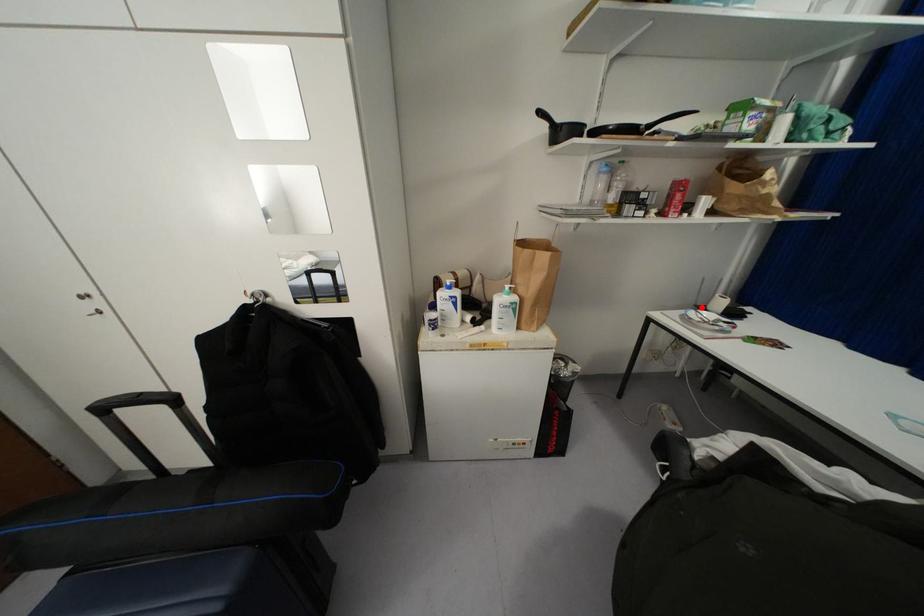
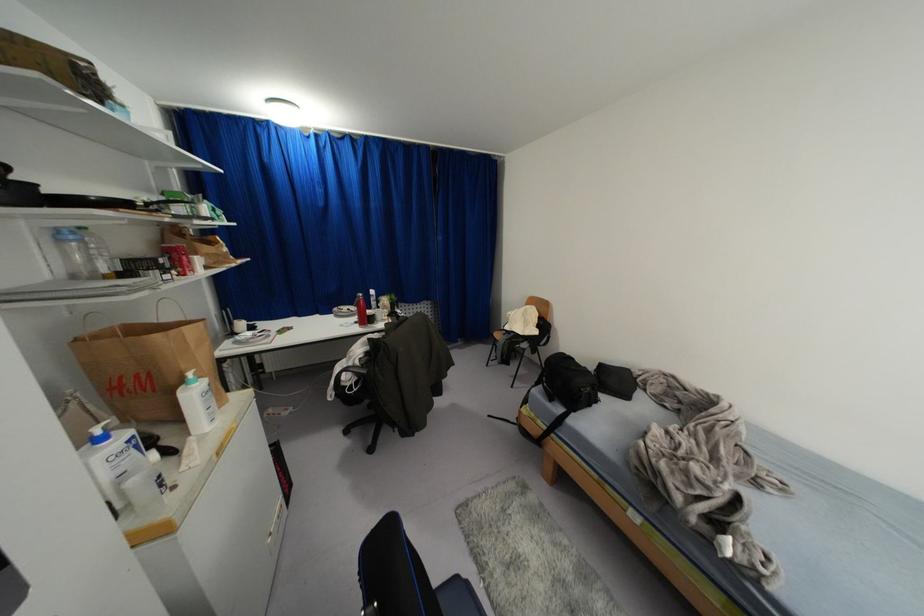
In the second image, find the point that corresponds to the highlighted location in the first image.

(234, 333)